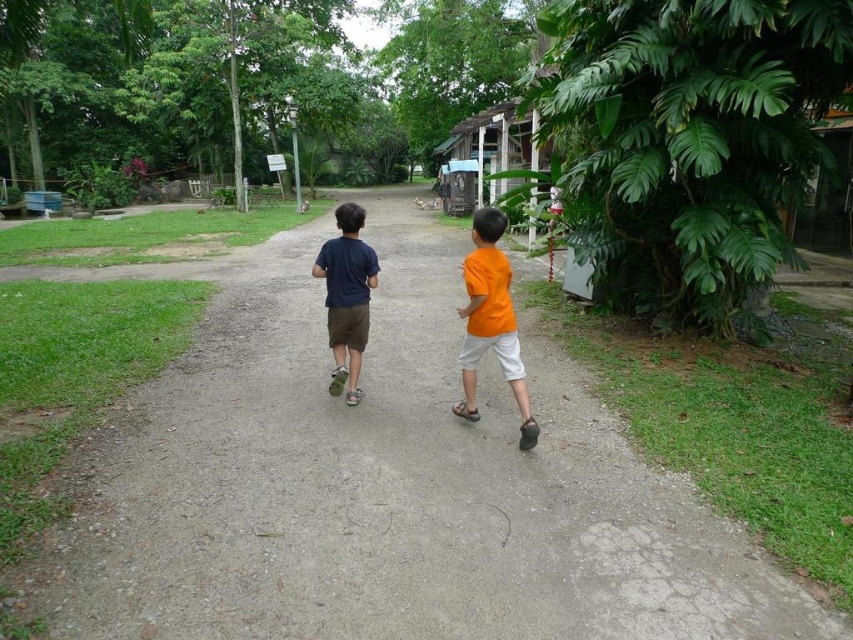
Does gray gravel path at center have a lesser height compared to matte blue shirt at center?

No, gray gravel path at center is not shorter than matte blue shirt at center.

Is point (515, 280) farther from viewer compared to point (344, 330)?

Yes, it is behind point (344, 330).

Where is `gray gravel path at center`? gray gravel path at center is located at coordinates (386, 483).

Does orange matte shirt at center have a greater height compared to matte blue shirt at center?

Yes, orange matte shirt at center is taller than matte blue shirt at center.

Is point (463, 266) positioned after point (354, 212)?

No, it is not.

Where is `orange matte shirt at center`? This screenshot has width=853, height=640. orange matte shirt at center is located at coordinates (491, 321).

Measure the distance between gray gravel path at center and camera.

8.63 feet

Between point (138, 595) and point (498, 228), which one is positioned behind?

Positioned behind is point (498, 228).

Is point (271, 573) behind point (492, 253)?

No, it is in front of (492, 253).

Where is `gray gravel path at center`? This screenshot has height=640, width=853. gray gravel path at center is located at coordinates point(386,483).